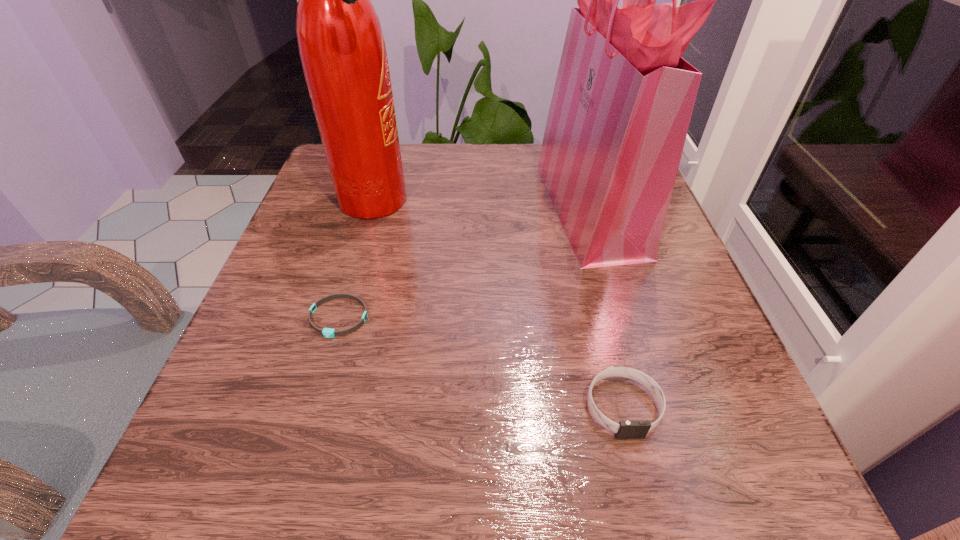
Find the location of `shopping bag`. shopping bag is located at coordinates pos(623,99).

Find the location of a particular element. This screenshot has height=540, width=960. fire extinguisher is located at coordinates (341, 45).

You are a GUI agent. You are given a task and a screenshot of the screen. Output one action in this format:
    pyautogui.click(x=<x>, y=<y>)
    Task: Click on the nearest object
    Image resolution: width=960 pixels, height=540 pixels.
    Given the screenshot: What is the action you would take?
    pyautogui.click(x=626, y=429)

Image resolution: width=960 pixels, height=540 pixels. I want to click on the taller wristband, so click(626, 429).

Find the location of `the farther wristband`. the farther wristband is located at coordinates (327, 332).

Where is `the shorter wristband`? The image size is (960, 540). the shorter wristband is located at coordinates coord(327,332).

Where is `free space located 0.350m on the front of the shopping bag`? This screenshot has height=540, width=960. free space located 0.350m on the front of the shopping bag is located at coordinates (x=665, y=460).

Locate an element on the screen. free space located on the right of the fire extinguisher is located at coordinates (540, 202).

This screenshot has width=960, height=540. Find the location of `vacant space located 0.060m on the outer surface of the right wristband`. vacant space located 0.060m on the outer surface of the right wristband is located at coordinates (643, 487).

Identify the location of free location located 0.120m on the buckle of the shortest object. The image size is (960, 540). (311, 409).